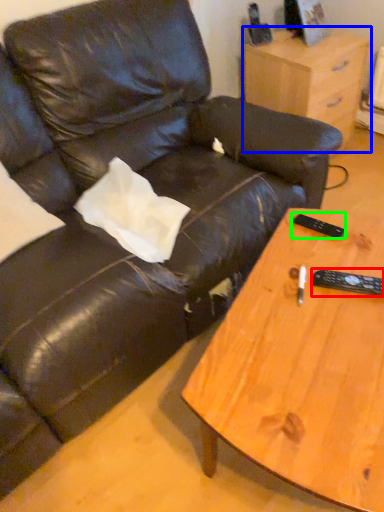
Question: Based on their relative distances, which object is nearer to remote (highlighted by a red box)? Choose from nightstand (highlighted by a blue box) and remote (highlighted by a green box).

Choices:
 (A) nightstand
 (B) remote

Answer: (B)